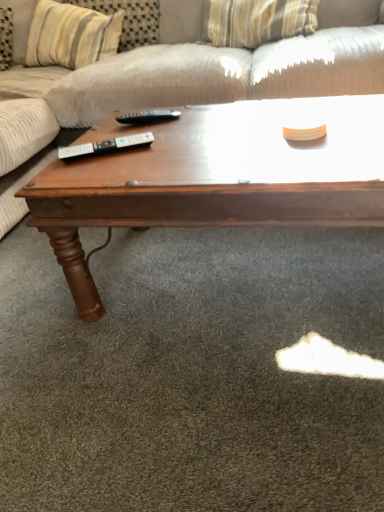
Question: Considering the positions of textured beige fabric couch at upper center and black plastic remote at center, positioned as the 1th remote in front-to-back order, in the image, is textured beige fabric couch at upper center bigger or smaller than black plastic remote at center, positioned as the 1th remote in front-to-back order,?

Choices:
 (A) small
 (B) big

Answer: (B)

Question: Is textured beige fabric couch at upper center in front of or behind black plastic remote at center, which ranks as the second remote in back-to-front order, in the image?

Choices:
 (A) front
 (B) behind

Answer: (A)

Question: Which object is the closest to the dark wood coffee table at center?

Choices:
 (A) black plastic remote at center, which ranks as the second remote in back-to-front order
 (B) textured beige fabric couch at upper center
 (C) striped fabric pillow at upper center
 (D) black plastic remote at center, the 1th remote from the back

Answer: (A)

Question: Considering the real-world distances, which object is closest to the striped fabric pillow at upper center?

Choices:
 (A) black plastic remote at center, the 1th remote from the back
 (B) textured beige fabric couch at upper center
 (C) black plastic remote at center, positioned as the 1th remote in front-to-back order
 (D) dark wood coffee table at center

Answer: (B)